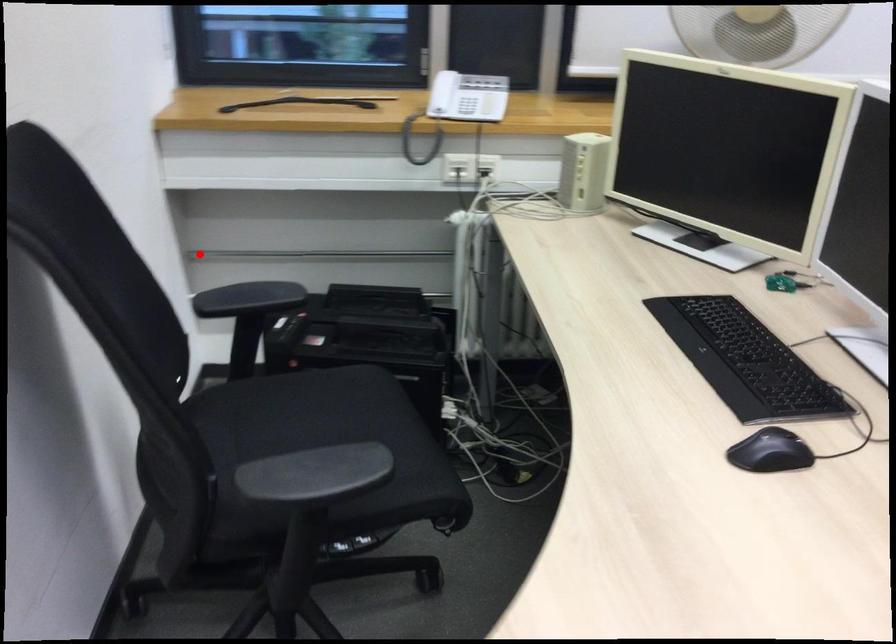
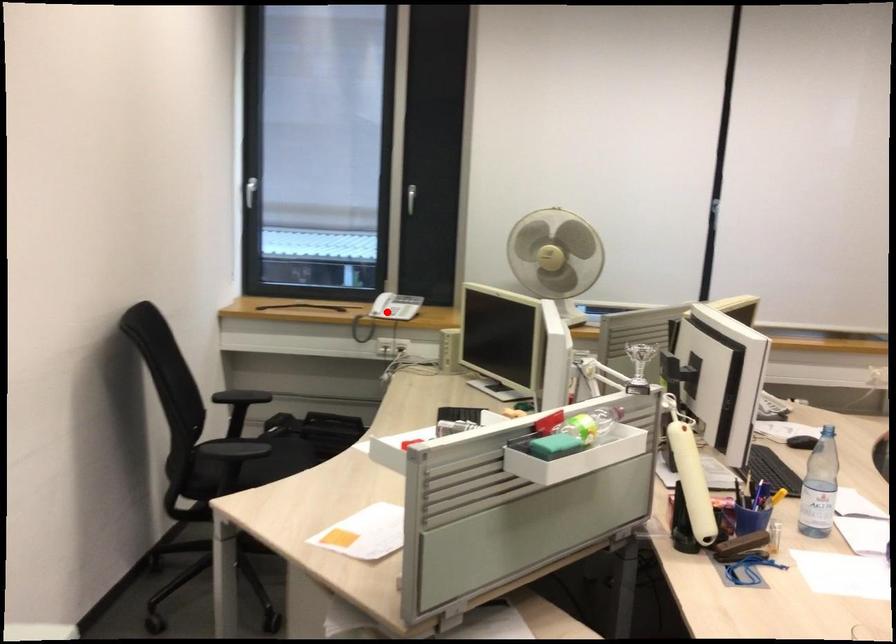
I am providing you with two images of the same scene from different viewpoints. A red point is marked on the first image and another point is marked on the second image. Is the red point in image1 aligned with the point shown in image2?

No